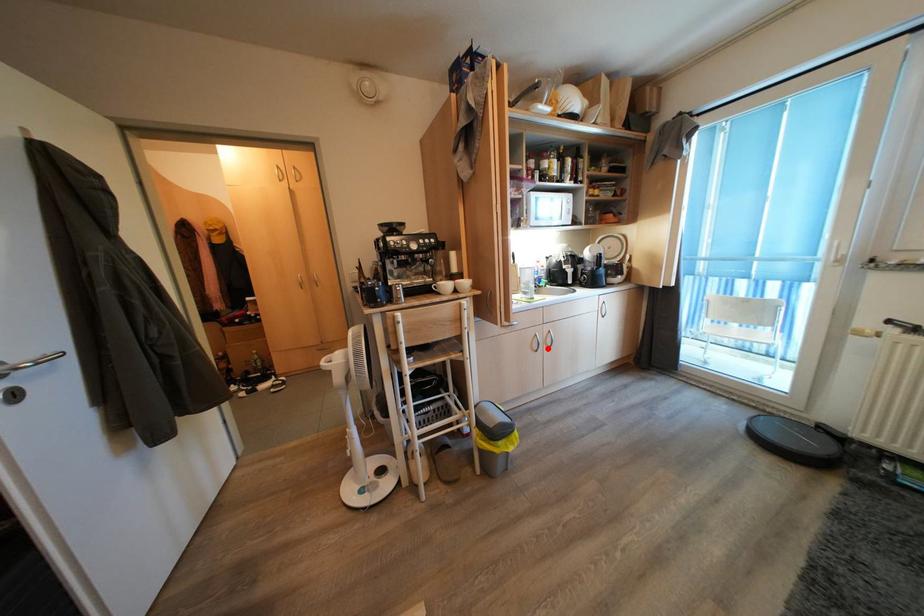
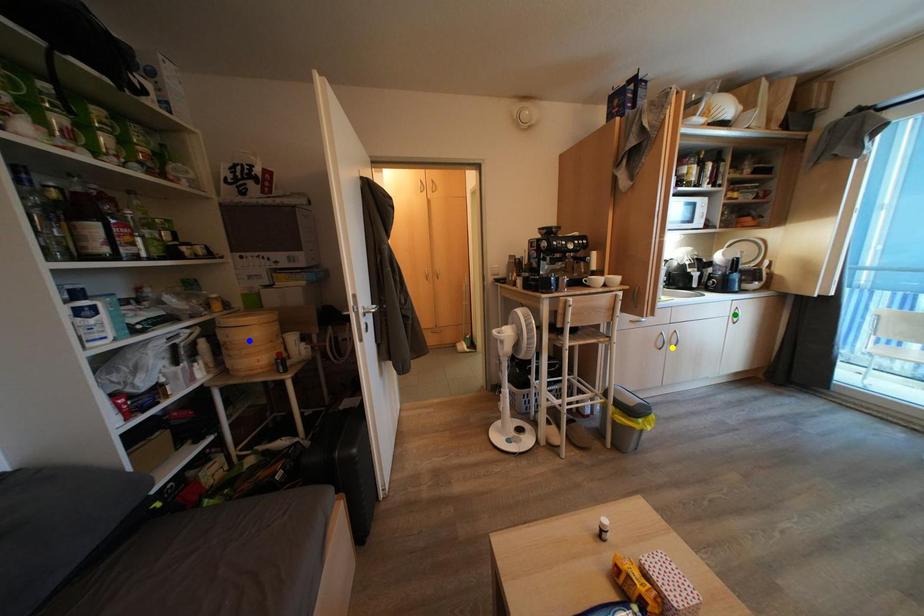
Question: I am providing you with two images of the same scene from different viewpoints. A red point is marked on the first image. You are given multiple points on the second image. Which point in image 2 is actually the same real-world point as the red point in image 1?

Choices:
 (A) blue point
 (B) yellow point
 (C) green point

Answer: (B)